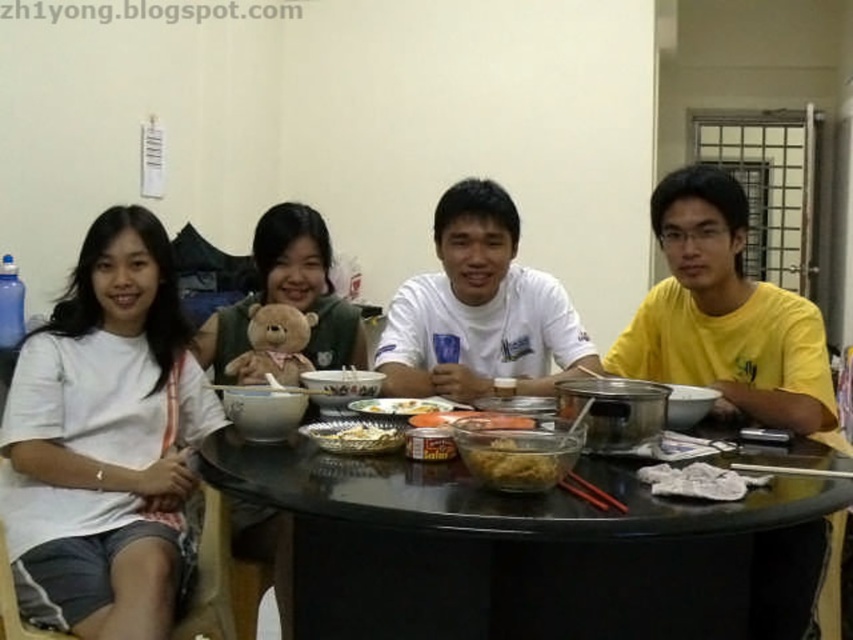
Question: Is translucent glass bowl at center further to camera compared to white matte plate at center?

Choices:
 (A) no
 (B) yes

Answer: (A)

Question: Among these objects, which one is farthest from the camera?

Choices:
 (A) translucent glass bowl at center
 (B) smooth plastic container at center
 (C) wooden chopsticks at table center

Answer: (B)

Question: In this image, where is white cotton shirt at left located relative to white matte teddy bear at upper center?

Choices:
 (A) below
 (B) above

Answer: (A)

Question: Among these objects, which one is farthest from the camera?

Choices:
 (A) wooden chopsticks at table center
 (B) white matte plate at center
 (C) shiny plastic bowl at center

Answer: (B)

Question: Which point is closer to the camera taking this photo?

Choices:
 (A) (345, 483)
 (B) (326, 428)
 (C) (134, 636)

Answer: (A)

Question: Can you confirm if translucent glass bowl at center is thinner than shiny plastic bowl at center?

Choices:
 (A) yes
 (B) no

Answer: (A)